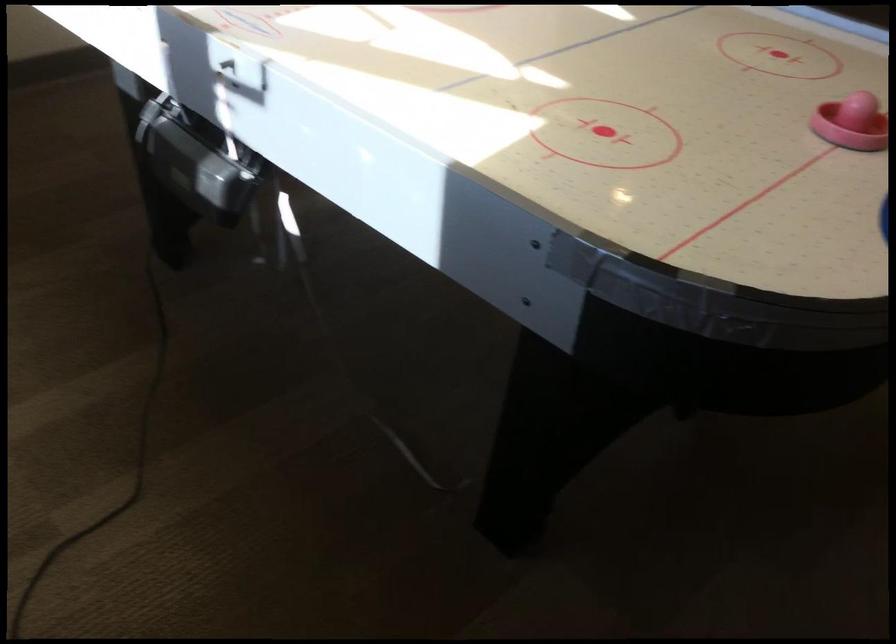
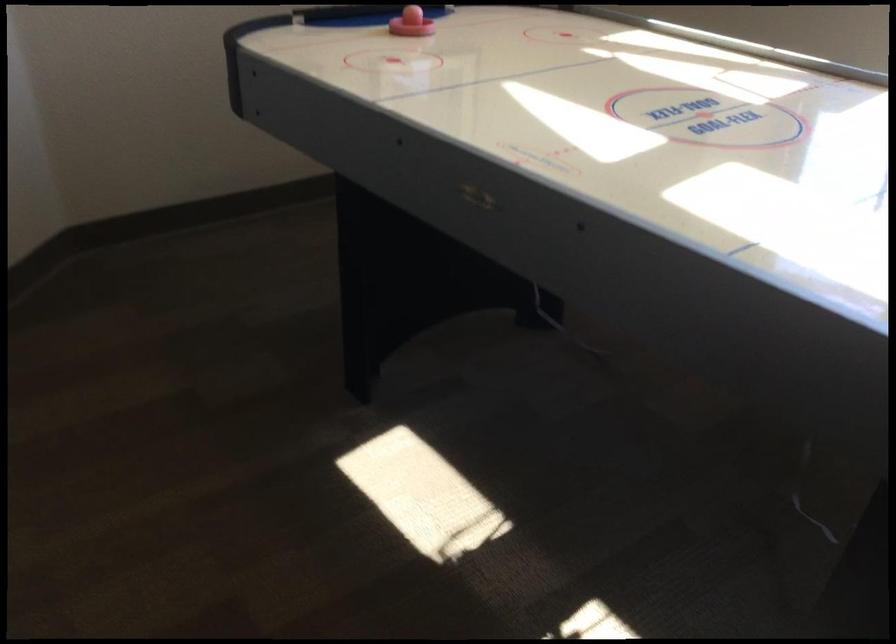
Find the pixel in the second image that matches (x=812, y=100) in the first image.

(410, 23)